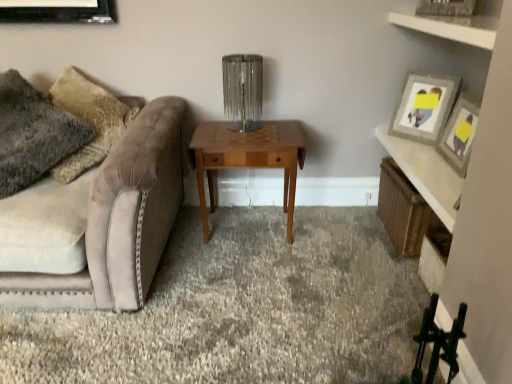
The image size is (512, 384). Find the location of `vacant area situated below wooden table at center (from a real-world perspective)`. vacant area situated below wooden table at center (from a real-world perspective) is located at coordinates (248, 232).